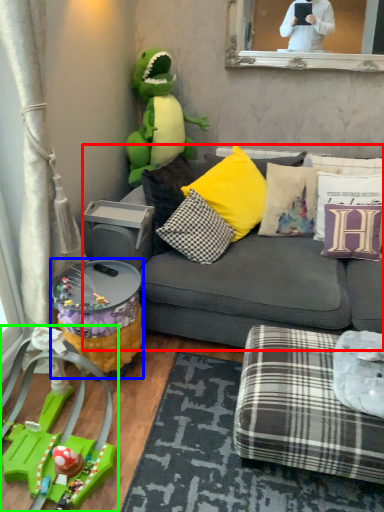
Question: Estimate the real-world distances between objects in this image. Which object is farther from studio couch (highlighted by a red box), side table (highlighted by a blue box) or toy (highlighted by a green box)?

Choices:
 (A) side table
 (B) toy

Answer: (B)